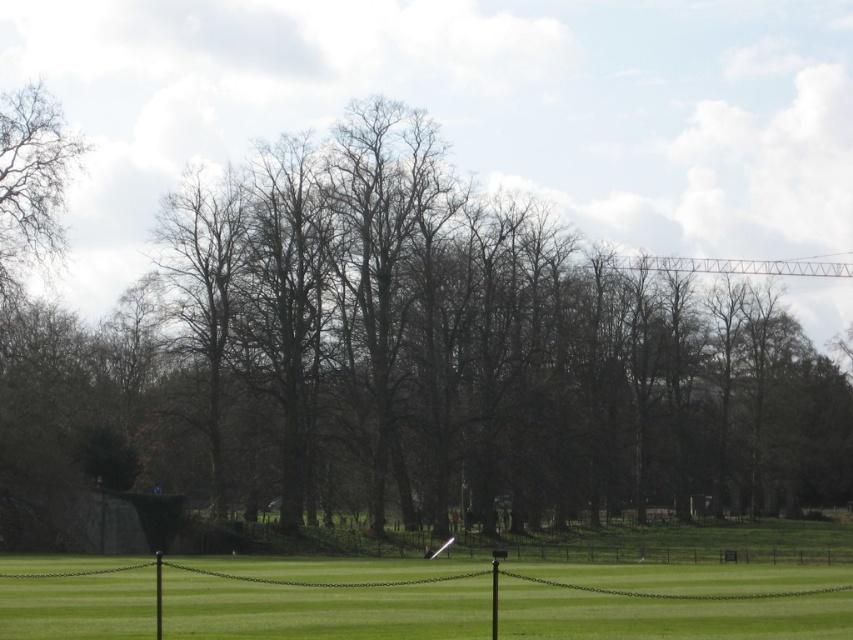
You are standing in front of the fence and want to walk to the brown leafless tree at center. Which direction should you walk relative to the bare branches at left?

The brown leafless tree at center is 115.81 feet away from the bare branches at left. To reach the brown leafless tree at center, you should walk towards the center direction relative to the bare branches at left.